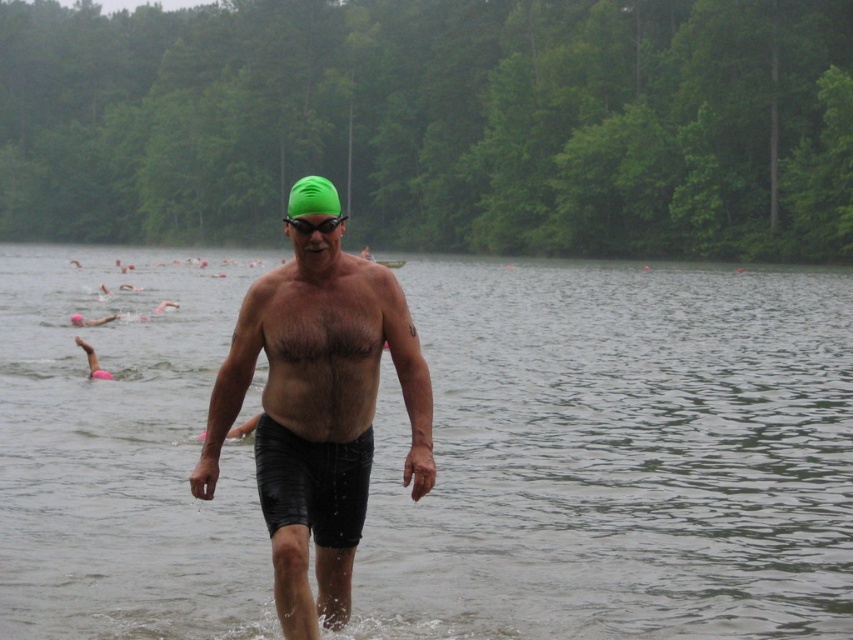
You are a lifeguard observing the lake scene. You need to determine if the green matte swim cap at center can fully cover the black rubber shorts at center in terms of width. Based on the description, what is your conclusion?

The green matte swim cap at center has a larger width than the black rubber shorts at center, so it can fully cover the black rubber shorts at center in terms of width.

Looking at this image, you are a lifeguard on duty at the lake. You notice a swimmer wearing black rubber shorts at center and see clear water at center. Based on their positions, which object is higher in the image?

The clear water at center is taller than the black rubber shorts at center, so the clear water at center is higher in the image.